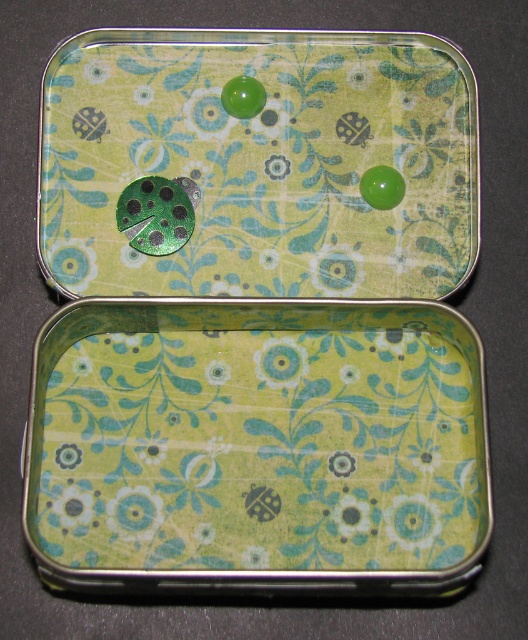
You are looking at a rectangular metal tin box with a hinged lid. There is a green floral pattern on it. You want to place a small key on the tray located at point (x=258, y=448). Can you confirm if the tray is large enough to hold the key?

The green floral patterned tray at center is located at point (x=258, y=448). Since the tray is at the center, it is likely large enough to hold the key.